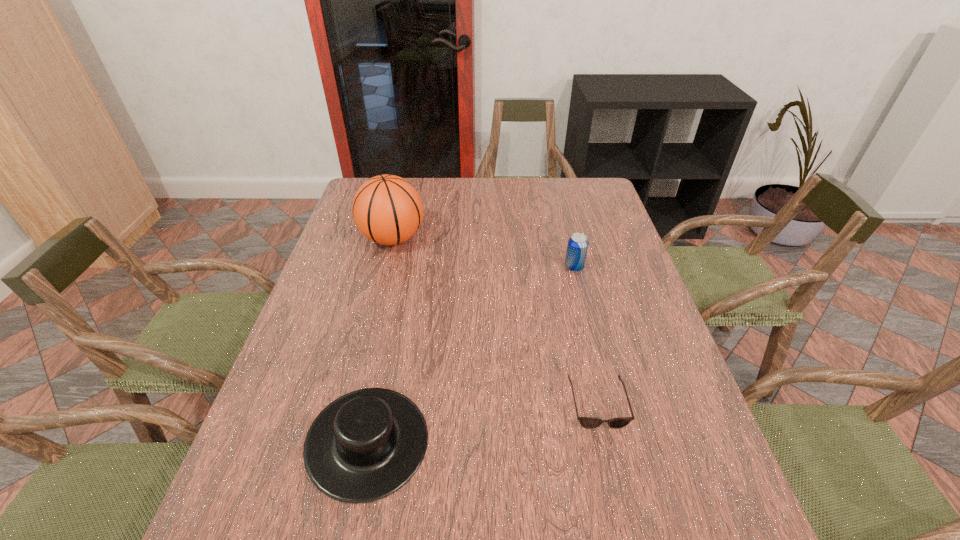
Image resolution: width=960 pixels, height=540 pixels. What are the coordinates of `dress hat at the left edge` in the screenshot? It's located at coord(365,445).

Locate an element on the screen. The image size is (960, 540). beer can located in the right edge section of the desktop is located at coordinates (577, 247).

Image resolution: width=960 pixels, height=540 pixels. In order to click on sunglasses that is at the right edge in this screenshot , I will do `click(587, 422)`.

Where is `free location at the far edge of the desktop`? The width and height of the screenshot is (960, 540). free location at the far edge of the desktop is located at coordinates (534, 199).

Image resolution: width=960 pixels, height=540 pixels. In order to click on free point at the left edge in this screenshot , I will do `click(339, 248)`.

Locate an element on the screen. free space at the right edge is located at coordinates (716, 474).

You are a GUI agent. You are given a task and a screenshot of the screen. Output one action in this format:
    pyautogui.click(x=<x>, y=<y>)
    Task: Click on the vacant area at the far right corner
    
    Given the screenshot: What is the action you would take?
    pyautogui.click(x=579, y=205)

Find the location of a particular element. The width and height of the screenshot is (960, 540). vacant area that lies between the shortest object and the beer can is located at coordinates (586, 336).

In order to click on unoccupied area between the shortest object and the dress hat in this screenshot , I will do `click(483, 423)`.

Locate an element on the screen. This screenshot has width=960, height=540. vacant region between the beer can and the tallest object is located at coordinates tap(483, 253).